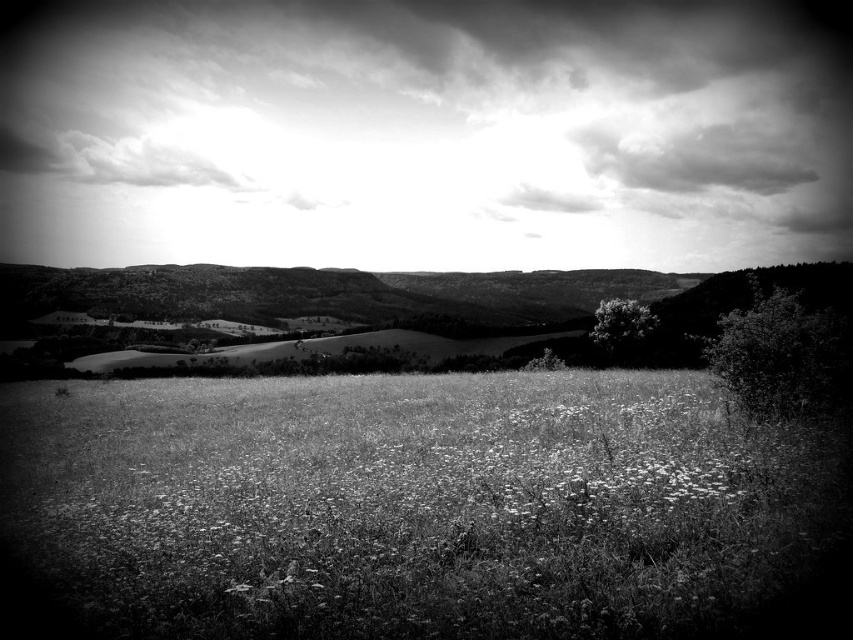
Can you confirm if dark green leafy tree at right is bigger than white textured tree at center?

Incorrect, dark green leafy tree at right is not larger than white textured tree at center.

Can you confirm if dark green leafy tree at right is taller than white textured tree at center?

No.

Is point (756, 397) positioned after point (637, 336)?

No, it is not.

Locate an element on the screen. The height and width of the screenshot is (640, 853). dark green leafy tree at right is located at coordinates (781, 355).

The width and height of the screenshot is (853, 640). Find the location of `cloudy sky at upper center`. cloudy sky at upper center is located at coordinates (424, 132).

From the picture: Between cloudy sky at upper center and green leafy tree at center, which one is positioned higher?

cloudy sky at upper center

Is point (694, 113) positioned behind point (556, 368)?

That is True.

Find the location of `cloudy sky at upper center`. cloudy sky at upper center is located at coordinates (424, 132).

Between point (288, 536) and point (561, 365), which one is positioned behind?

Positioned behind is point (561, 365).

The image size is (853, 640). In order to click on white soft grass at center in this screenshot , I will do `click(418, 509)`.